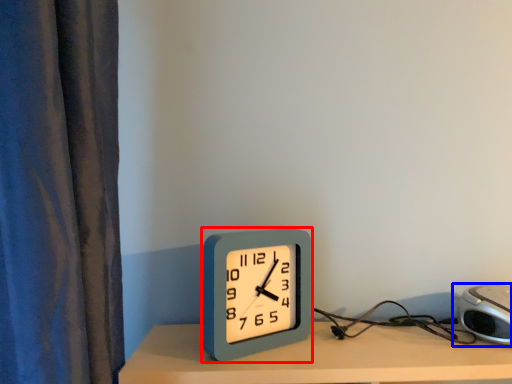
Question: Which object is closer to the camera taking this photo, alarm clock (highlighted by a red box) or alarm clock (highlighted by a blue box)?

Choices:
 (A) alarm clock
 (B) alarm clock

Answer: (B)